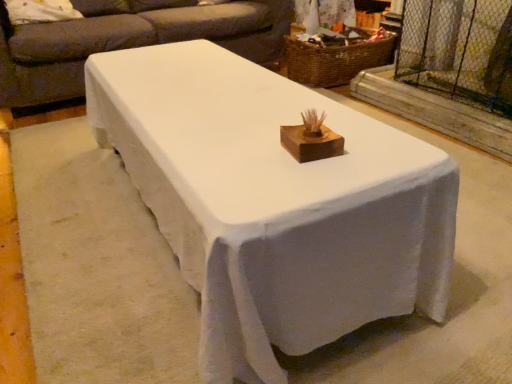
Identify the location of matte gray couch at upper center. The width and height of the screenshot is (512, 384). (130, 40).

The image size is (512, 384). Describe the element at coordinates (274, 204) in the screenshot. I see `white painted wood table at center` at that location.

This screenshot has width=512, height=384. Find the location of `woven brown basket at upper center`. woven brown basket at upper center is located at coordinates (334, 60).

Can you confirm if matte gray couch at upper center is positioned to the left of woven brown basket at upper center?

Yes, matte gray couch at upper center is to the left of woven brown basket at upper center.

Which object is wider, matte gray couch at upper center or woven brown basket at upper center?

Wider between the two is matte gray couch at upper center.

Who is more distant, matte gray couch at upper center or woven brown basket at upper center?

woven brown basket at upper center is more distant.

Is matte gray couch at upper center directly adjacent to woven brown basket at upper center?

No, matte gray couch at upper center is not with woven brown basket at upper center.

Considering the sizes of objects white painted wood table at center and woven brown basket at upper center in the image provided, who is taller, white painted wood table at center or woven brown basket at upper center?

woven brown basket at upper center is taller.

Identify the location of basket above the white painted wood table at center (from the image's perspective). (334, 60).

In the image, is white painted wood table at center positioned in front of or behind woven brown basket at upper center?

white painted wood table at center is in front of woven brown basket at upper center.

Based on their positions, is white painted wood table at center located to the left or right of woven brown basket at upper center?

From the image, it's evident that white painted wood table at center is to the left of woven brown basket at upper center.

Is the surface of matte gray couch at upper center in direct contact with wooden at center?

No, matte gray couch at upper center is not beside wooden at center.

Considering the positions of objects matte gray couch at upper center and wooden at center in the image provided, who is more to the left, matte gray couch at upper center or wooden at center?

From the viewer's perspective, matte gray couch at upper center appears more on the left side.

How many degrees apart are the facing directions of matte gray couch at upper center and wooden at center?

matte gray couch at upper center and wooden at center are facing 85 degrees away from each other.

Is white painted wood table at center to the right of clear plastic screen door at upper right from the viewer's perspective?

No.

Who is taller, white painted wood table at center or clear plastic screen door at upper right?

clear plastic screen door at upper right.

This screenshot has height=384, width=512. I want to click on table below the clear plastic screen door at upper right (from a real-world perspective), so click(x=274, y=204).

From the image's perspective, is white painted wood table at center beneath clear plastic screen door at upper right?

Yes.

From the image's perspective, is clear plastic screen door at upper right over woven brown basket at upper center?

Actually, clear plastic screen door at upper right appears below woven brown basket at upper center in the image.

Considering the positions of point (507, 117) and point (334, 54), is point (507, 117) closer or farther from the camera than point (334, 54)?

Clearly, point (507, 117) is closer to the camera than point (334, 54).

Is clear plastic screen door at upper right facing towards woven brown basket at upper center?

No, clear plastic screen door at upper right is not oriented towards woven brown basket at upper center.

Is clear plastic screen door at upper right inside the boundaries of woven brown basket at upper center, or outside?

clear plastic screen door at upper right is not enclosed by woven brown basket at upper center.

Does woven brown basket at upper center come behind matte gray couch at upper center?

Yes, woven brown basket at upper center is further from the viewer.

Is woven brown basket at upper center looking in the opposite direction of matte gray couch at upper center?

No, matte gray couch at upper center is not at the back of woven brown basket at upper center.

The image size is (512, 384). In order to click on basket behind the matte gray couch at upper center in this screenshot , I will do `click(334, 60)`.

This screenshot has width=512, height=384. I want to click on candle holder located on the left of clear plastic screen door at upper right, so click(311, 139).

In the scene shown: Is wooden at center oriented away from clear plastic screen door at upper right?

No, clear plastic screen door at upper right is not at the back of wooden at center.

Which is behind, wooden at center or clear plastic screen door at upper right?

clear plastic screen door at upper right.

Considering the sizes of wooden at center and clear plastic screen door at upper right in the image, is wooden at center wider or thinner than clear plastic screen door at upper right?

wooden at center is thinner than clear plastic screen door at upper right.

This screenshot has height=384, width=512. What are the coordinates of `basket on the right of matte gray couch at upper center` in the screenshot? It's located at (334, 60).

The image size is (512, 384). In order to click on basket above the white painted wood table at center (from the image's perspective) in this screenshot , I will do `click(334, 60)`.

Considering their positions, is wooden at center positioned closer to woven brown basket at upper center than matte gray couch at upper center?

Among the two, matte gray couch at upper center is located nearer to woven brown basket at upper center.

Estimate the real-world distances between objects in this image. Which object is closer to woven brown basket at upper center, white painted wood table at center or matte gray couch at upper center?

matte gray couch at upper center lies closer to woven brown basket at upper center than the other object.

Considering their positions, is matte gray couch at upper center positioned closer to woven brown basket at upper center than white painted wood table at center?

matte gray couch at upper center is closer to woven brown basket at upper center.

Based on their spatial positions, is wooden at center or white painted wood table at center further from woven brown basket at upper center?

wooden at center is further to woven brown basket at upper center.

Which object lies further to the anchor point wooden at center, clear plastic screen door at upper right or white painted wood table at center?

clear plastic screen door at upper right is positioned further to the anchor wooden at center.

Which object lies further to the anchor point matte gray couch at upper center, white painted wood table at center or wooden at center?

wooden at center lies further to matte gray couch at upper center than the other object.

From the image, which object appears to be farther from wooden at center, clear plastic screen door at upper right or matte gray couch at upper center?

Among the two, matte gray couch at upper center is located further to wooden at center.

Which object lies further to the anchor point clear plastic screen door at upper right, white painted wood table at center or wooden at center?

Among the two, wooden at center is located further to clear plastic screen door at upper right.

The height and width of the screenshot is (384, 512). In order to click on basket situated between matte gray couch at upper center and clear plastic screen door at upper right from left to right in this screenshot , I will do `click(334, 60)`.

Locate an element on the screen. candle holder located between white painted wood table at center and clear plastic screen door at upper right in the depth direction is located at coordinates (311, 139).

The image size is (512, 384). Find the location of `table located between matte gray couch at upper center and clear plastic screen door at upper right in the left-right direction`. table located between matte gray couch at upper center and clear plastic screen door at upper right in the left-right direction is located at coordinates (x=274, y=204).

You are a GUI agent. You are given a task and a screenshot of the screen. Output one action in this format:
    pyautogui.click(x=<x>, y=<y>)
    Task: Click on the candle holder located between white painted wood table at center and woven brown basket at upper center in the depth direction
    
    Given the screenshot: What is the action you would take?
    pyautogui.click(x=311, y=139)